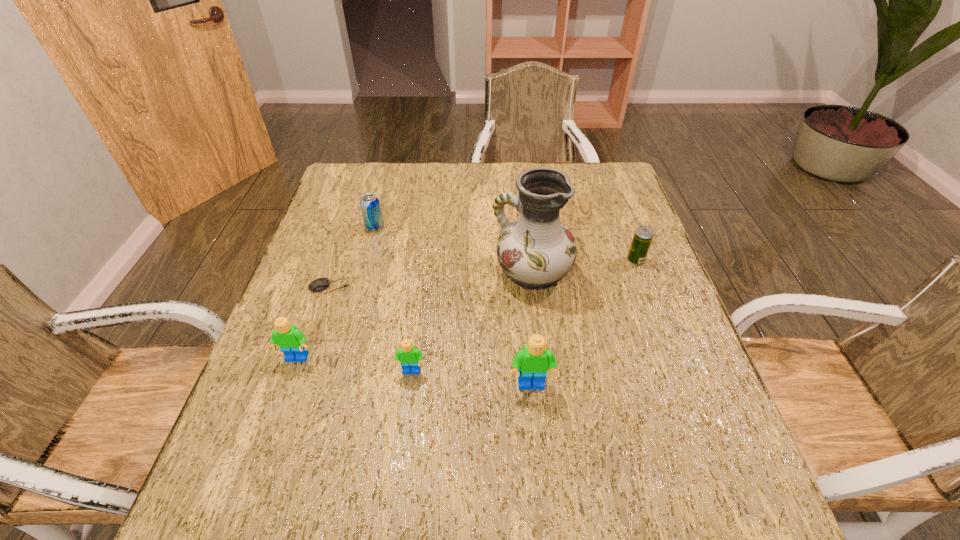
Image resolution: width=960 pixels, height=540 pixels. Find the location of `Lego that can be found as the second closest to the farther beer can`. Lego that can be found as the second closest to the farther beer can is located at coordinates (410, 357).

The height and width of the screenshot is (540, 960). I want to click on Lego that is the third closest to the right beer can, so click(292, 341).